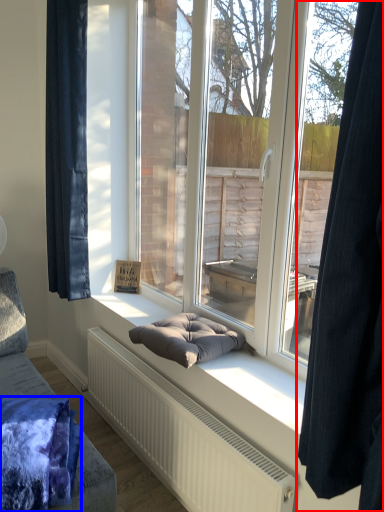
Question: Which of the following is the farthest to the observer, curtain (highlighted by a red box) or blanket (highlighted by a blue box)?

Choices:
 (A) curtain
 (B) blanket

Answer: (B)